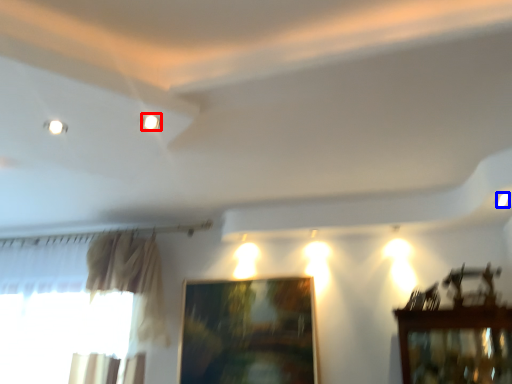
Question: Which object is further to the camera taking this photo, lighting (highlighted by a red box) or light (highlighted by a blue box)?

Choices:
 (A) lighting
 (B) light

Answer: (B)